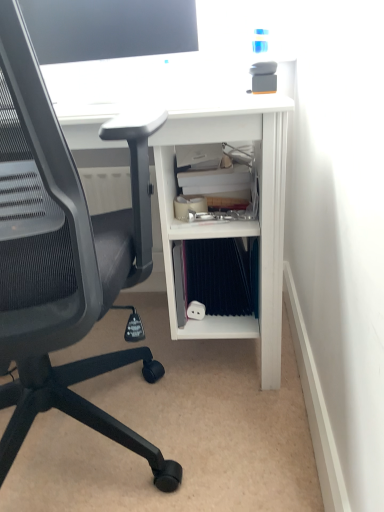
You are a GUI agent. You are given a task and a screenshot of the screen. Output one action in this format:
    pyautogui.click(x=<x>, y=<y>)
    Task: Click on the matte black monitor at upper center
    This screenshot has width=384, height=512.
    Given the screenshot: What is the action you would take?
    pyautogui.click(x=108, y=32)

Identify the location of black mesh chair at left. The height and width of the screenshot is (512, 384). (58, 261).

Is matte black monitor at upper center next to white matte desk at center?

No, matte black monitor at upper center is not in contact with white matte desk at center.

From the image's perspective, who appears lower, matte black monitor at upper center or white matte desk at center?

white matte desk at center.

Considering the sizes of objects matte black monitor at upper center and white matte desk at center in the image provided, who is taller, matte black monitor at upper center or white matte desk at center?

white matte desk at center.

Does matte black monitor at upper center turn towards white matte desk at center?

No, matte black monitor at upper center is not facing towards white matte desk at center.

Which object is more forward, blue fabric binder at lower center or matte black monitor at upper center?

blue fabric binder at lower center.

Which is in front, point (226, 239) or point (46, 33)?

The point (226, 239) is more forward.

Considering the sizes of objects blue fabric binder at lower center and matte black monitor at upper center in the image provided, who is smaller, blue fabric binder at lower center or matte black monitor at upper center?

blue fabric binder at lower center is smaller.

Is matte black monitor at upper center oriented away from blue fabric binder at lower center?

matte black monitor at upper center does not have its back to blue fabric binder at lower center.

Which is behind, point (56, 11) or point (202, 271)?

The point (56, 11) is more distant.

In the scene shown: Are matte black monitor at upper center and blue fabric binder at lower center beside each other?

There is a gap between matte black monitor at upper center and blue fabric binder at lower center.

Between matte black monitor at upper center and blue fabric binder at lower center, which one has larger width?

With larger width is matte black monitor at upper center.

How many degrees apart are the facing directions of white matte desk at center and matte black monitor at upper center?

The angle between the facing direction of white matte desk at center and the facing direction of matte black monitor at upper center is 0.794 degrees.

Is white matte desk at center wider or thinner than matte black monitor at upper center?

In the image, white matte desk at center appears to be wider than matte black monitor at upper center.

Which object is closer to the camera, white matte desk at center or matte black monitor at upper center?

Positioned in front is white matte desk at center.

Is white matte desk at center taller or shorter than matte black monitor at upper center?

In the image, white matte desk at center appears to be taller than matte black monitor at upper center.

Considering their positions, is matte black monitor at upper center located in front of or behind black mesh chair at left?

In the image, matte black monitor at upper center appears behind black mesh chair at left.

Between matte black monitor at upper center and black mesh chair at left, which one has more height?

black mesh chair at left.

In the image, there is a matte black monitor at upper center. Identify the location of chair below it (from the image's perspective). The height and width of the screenshot is (512, 384). (58, 261).

From the image's perspective, who appears lower, matte black monitor at upper center or black mesh chair at left?

black mesh chair at left is shown below in the image.

Is black mesh chair at left next to matte black monitor at upper center?

No, black mesh chair at left is not touching matte black monitor at upper center.

From a real-world perspective, which object rests below the other?

black mesh chair at left.

Considering the positions of objects black mesh chair at left and matte black monitor at upper center in the image provided, who is more to the right, black mesh chair at left or matte black monitor at upper center?

Positioned to the right is matte black monitor at upper center.

Is black mesh chair at left inside the boundaries of matte black monitor at upper center, or outside?

black mesh chair at left cannot be found inside matte black monitor at upper center.

From the picture: Does blue fabric binder at lower center turn towards white matte desk at center?

Yes, blue fabric binder at lower center is turned towards white matte desk at center.

How many degrees apart are the facing directions of blue fabric binder at lower center and white matte desk at center?

There is a 4.42-degree angle between the facing directions of blue fabric binder at lower center and white matte desk at center.

Do you think blue fabric binder at lower center is within white matte desk at center, or outside of it?

blue fabric binder at lower center is contained in white matte desk at center.

Which is behind, point (172, 249) or point (269, 244)?

The point (172, 249) is behind.

Where is `desktop computer behind the white matte desk at center`? This screenshot has width=384, height=512. desktop computer behind the white matte desk at center is located at coordinates (108, 32).

Find the location of `desktop computer on the left side of blue fabric binder at lower center`. desktop computer on the left side of blue fabric binder at lower center is located at coordinates (108, 32).

When comparing their distances from black mesh chair at left, does matte black monitor at upper center or blue fabric binder at lower center seem further?

Based on the image, matte black monitor at upper center appears to be further to black mesh chair at left.

When comparing their distances from blue fabric binder at lower center, does matte black monitor at upper center or white matte desk at center seem closer?

white matte desk at center.

From the image, which object appears to be nearer to matte black monitor at upper center, blue fabric binder at lower center or black mesh chair at left?

black mesh chair at left.

When comparing their distances from black mesh chair at left, does white matte desk at center or matte black monitor at upper center seem closer?

The object closer to black mesh chair at left is white matte desk at center.

Which object lies nearer to the anchor point matte black monitor at upper center, white matte desk at center or black mesh chair at left?

white matte desk at center lies closer to matte black monitor at upper center than the other object.

In the scene shown: Looking at the image, which one is located further to white matte desk at center, blue fabric binder at lower center or matte black monitor at upper center?

matte black monitor at upper center lies further to white matte desk at center than the other object.

Considering their positions, is blue fabric binder at lower center positioned further to black mesh chair at left than white matte desk at center?

The object further to black mesh chair at left is blue fabric binder at lower center.

Based on their spatial positions, is blue fabric binder at lower center or matte black monitor at upper center closer to black mesh chair at left?

Based on the image, blue fabric binder at lower center appears to be nearer to black mesh chair at left.

At what (x,y) coordinates should I click in order to perform the action: click on desk that lies between matte black monitor at upper center and blue fabric binder at lower center from top to bottom. Please return your answer as a coordinate pair (x, y). Image resolution: width=384 pixels, height=512 pixels. Looking at the image, I should click on (232, 222).

Identify the location of binder positioned between black mesh chair at left and matte black monitor at upper center from near to far. (216, 276).

Find the location of `desk between black mesh chair at left and matte black monitor at upper center in the front-back direction`. desk between black mesh chair at left and matte black monitor at upper center in the front-back direction is located at coordinates (232, 222).

This screenshot has width=384, height=512. In order to click on desk between black mesh chair at left and blue fabric binder at lower center along the z-axis in this screenshot , I will do `click(232, 222)`.